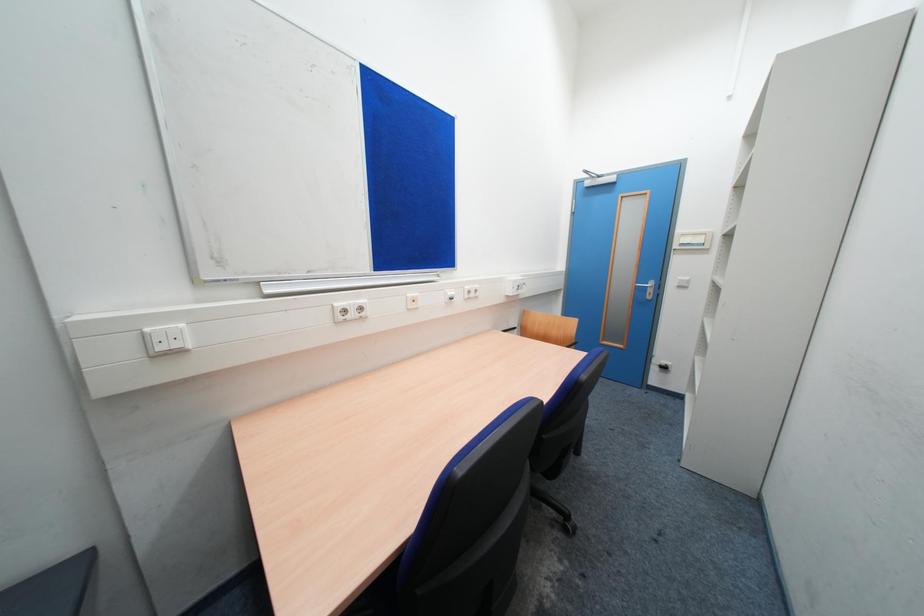
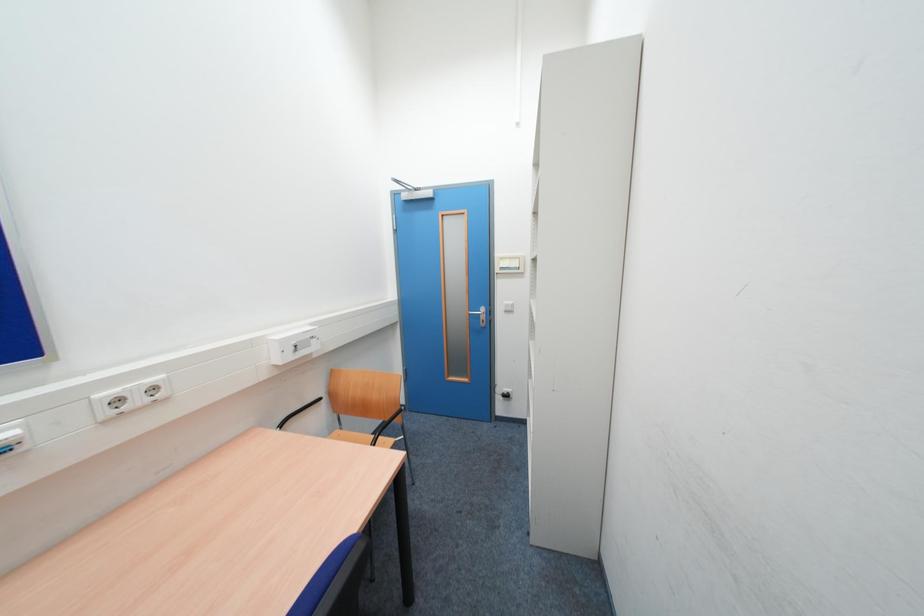
Question: The camera is either moving clockwise (left) or counter-clockwise (right) around the object. The first image is from the beginning of the video and the second image is from the end. Is the camera moving left or right when shooting the video?

Choices:
 (A) Left
 (B) Right

Answer: (A)